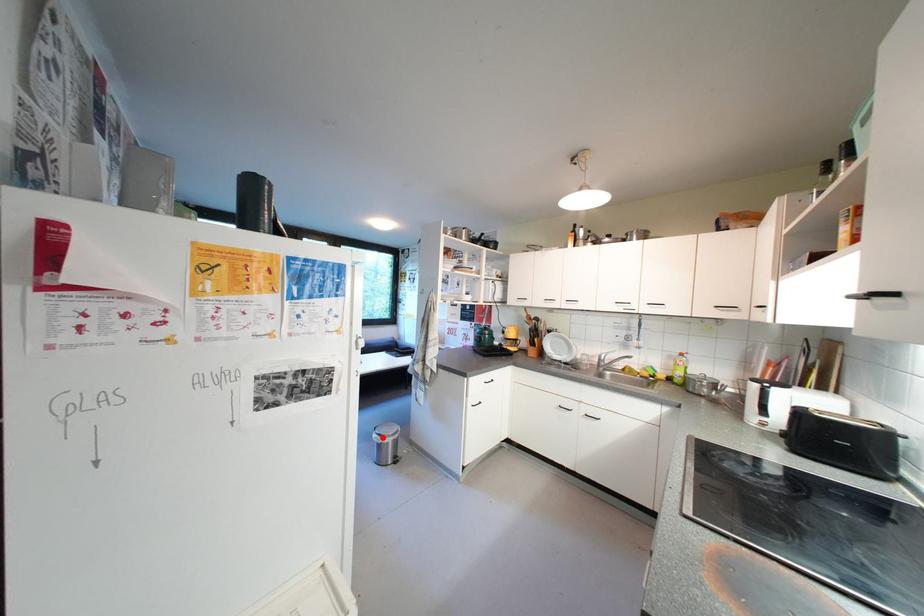
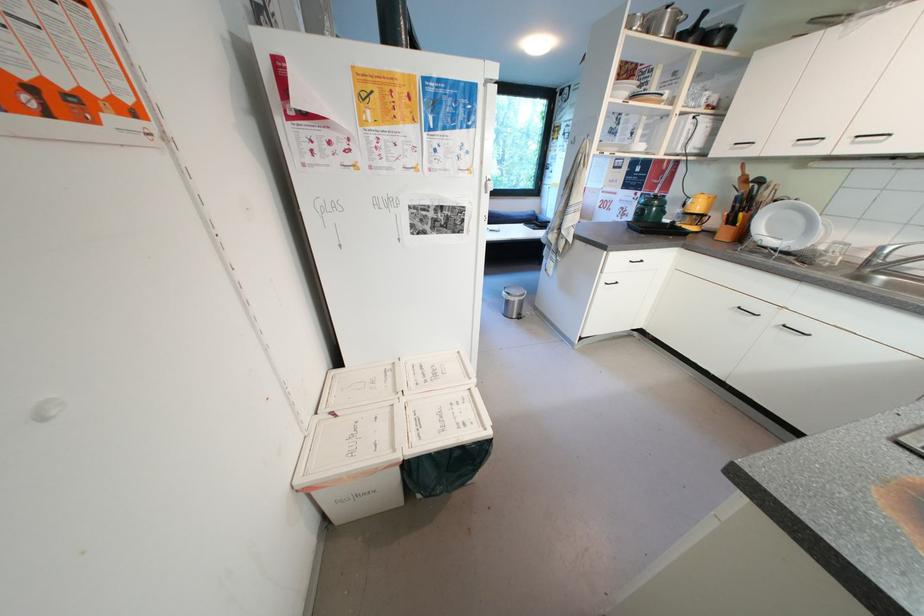
Question: I am providing you with two images of the same scene from different viewpoints. A red point is marked on the first image. Is the red point's position out of view in image 2?

Choices:
 (A) Yes
 (B) No

Answer: (B)